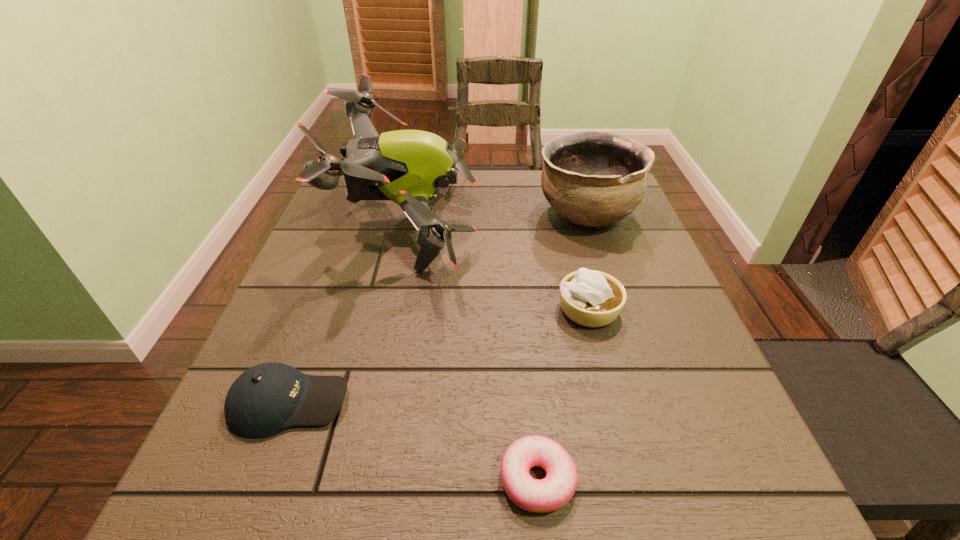
Locate an element on the screen. Image resolution: width=960 pixels, height=540 pixels. free location located on the front-facing side of the second nearest object is located at coordinates (484, 403).

Image resolution: width=960 pixels, height=540 pixels. Identify the location of vacant space located on the left of the doughnut. (394, 479).

The image size is (960, 540). Find the location of `drone located in the far edge section of the desktop`. drone located in the far edge section of the desktop is located at coordinates (406, 166).

Find the location of a particular element. Image resolution: width=960 pixels, height=540 pixels. pottery that is at the far edge is located at coordinates click(591, 178).

The width and height of the screenshot is (960, 540). I want to click on object that is at the near edge, so click(x=551, y=493).

Identify the location of drone that is at the left edge. Image resolution: width=960 pixels, height=540 pixels. (406, 166).

The width and height of the screenshot is (960, 540). Find the location of `baseball cap positioned at the left edge`. baseball cap positioned at the left edge is located at coordinates (264, 400).

What are the coordinates of `pottery at the right edge` in the screenshot? It's located at (591, 178).

The image size is (960, 540). Identify the location of whipped cream present at the right edge. (590, 298).

This screenshot has width=960, height=540. Identify the location of object that is at the far left corner. (406, 166).